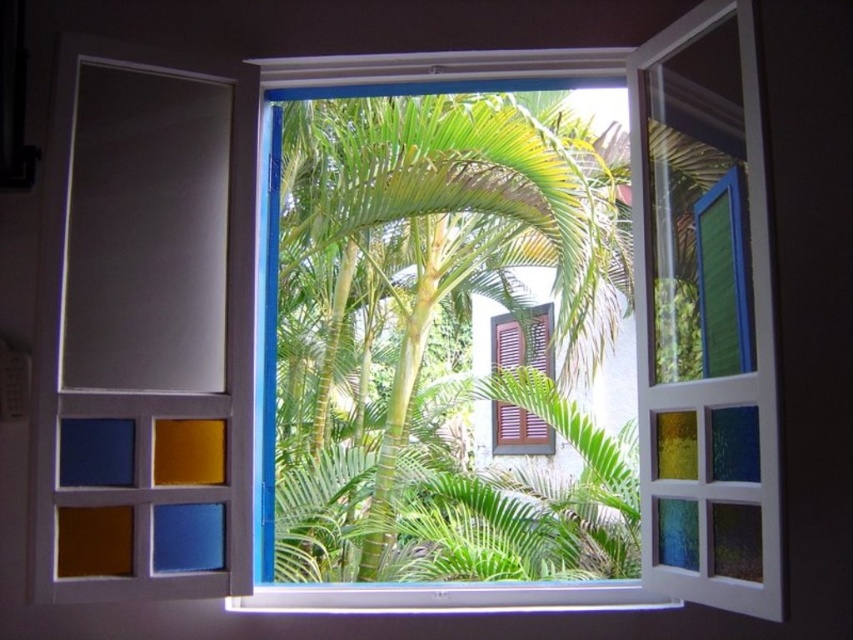
Is point (285, 444) behind point (543, 422)?

That is False.

Which of these two, green leafy palm tree at center or brown wooden shutter at center, stands taller?

Standing taller between the two is green leafy palm tree at center.

Which is behind, point (498, 410) or point (492, 449)?

Point (492, 449)

Locate an element on the screen. green leafy palm tree at center is located at coordinates (448, 337).

Between green leafy palm tree at center and matte glass shutter at left, which one is positioned lower?

matte glass shutter at left is lower down.

Based on the photo, which is more to the right, green leafy palm tree at center or matte glass shutter at left?

Positioned to the right is green leafy palm tree at center.

Is point (320, 161) behind point (80, 198)?

That is True.

Where is `green leafy palm tree at center`? This screenshot has height=640, width=853. green leafy palm tree at center is located at coordinates (448, 337).

Between matte glass shutter at left and white plastic window sill at lower center, which one has more height?

matte glass shutter at left

Looking at this image, how far apart are matte glass shutter at left and white plastic window sill at lower center?

matte glass shutter at left and white plastic window sill at lower center are 25.60 inches apart from each other.

Who is more distant from viewer, (215,502) or (288,596)?

The point (288,596) is more distant.

The width and height of the screenshot is (853, 640). In order to click on matte glass shutter at left in this screenshot , I will do `click(134, 333)`.